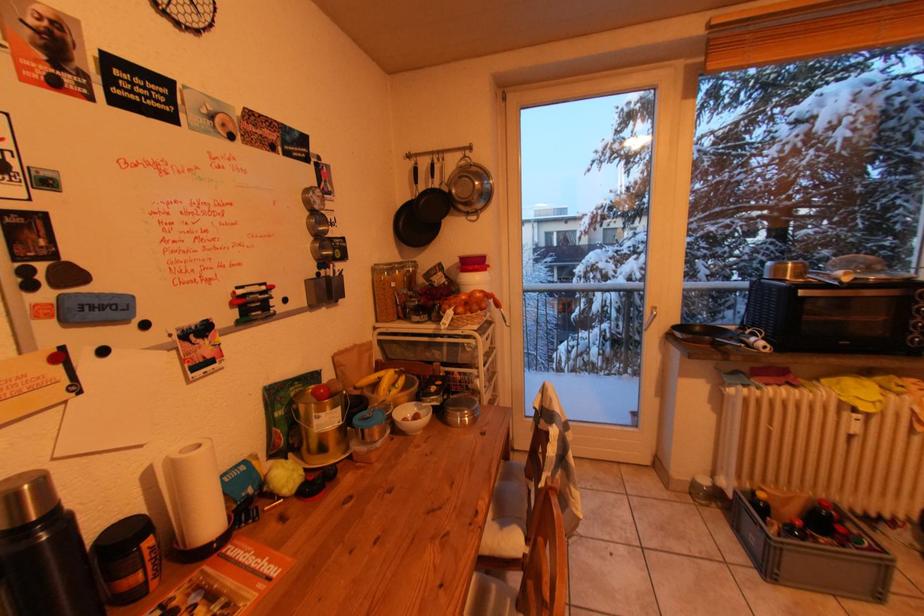
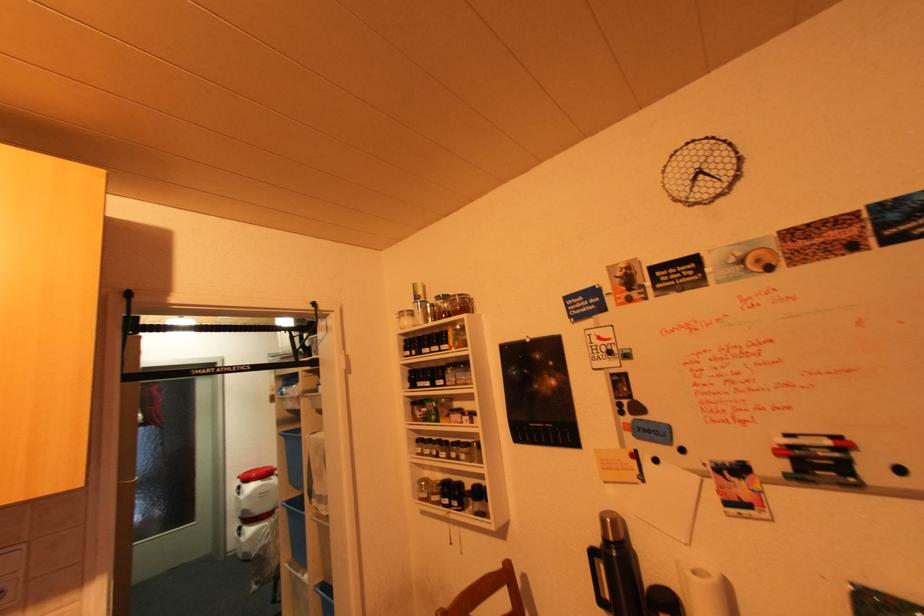
Question: The images are taken continuously from a first-person perspective. In which direction is your viewpoint rotating?

Choices:
 (A) Left
 (B) Right
 (C) Up
 (D) Down

Answer: (A)